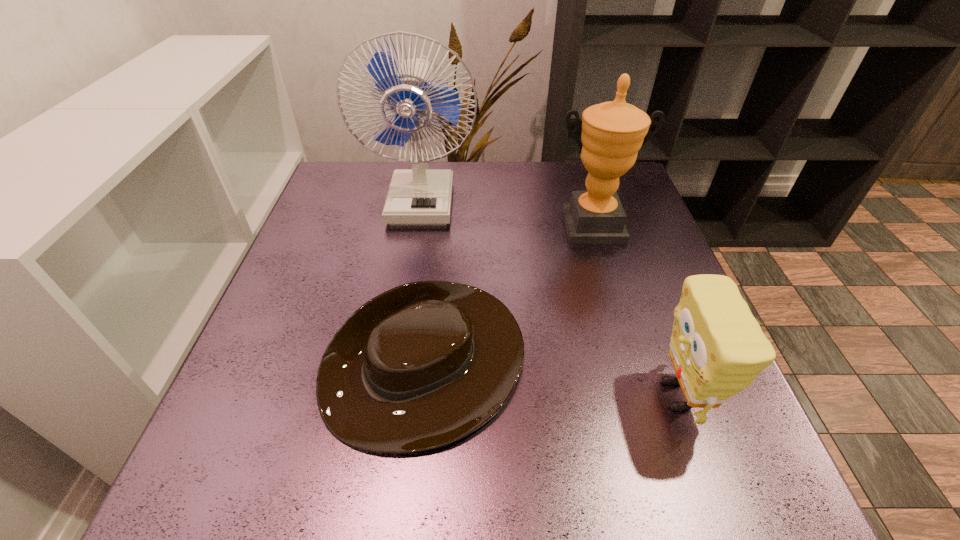
I want to click on object present at the far edge, so click(419, 196).

I want to click on object situated at the near edge, so click(420, 366).

Identify the location of fan that is positioned at the left edge. (419, 196).

Where is `cowboy hat that is at the left edge`? The height and width of the screenshot is (540, 960). cowboy hat that is at the left edge is located at coordinates (420, 366).

Where is `award that is at the right edge`? award that is at the right edge is located at coordinates (613, 132).

Where is `sponge at the right edge`? The width and height of the screenshot is (960, 540). sponge at the right edge is located at coordinates (717, 348).

The height and width of the screenshot is (540, 960). I want to click on object present at the far left corner, so click(419, 196).

This screenshot has height=540, width=960. What are the coordinates of `object located in the near left corner section of the desktop` in the screenshot? It's located at (420, 366).

This screenshot has height=540, width=960. What are the coordinates of `free space at the far edge of the desktop` in the screenshot? It's located at (548, 170).

The height and width of the screenshot is (540, 960). In order to click on free spot at the near edge of the desktop in this screenshot , I will do `click(443, 471)`.